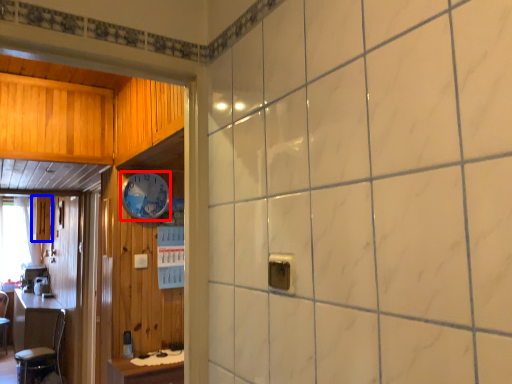
Question: Which point is further to the camera, clock (highlighted by a red box) or cabinetry (highlighted by a blue box)?

Choices:
 (A) clock
 (B) cabinetry

Answer: (B)